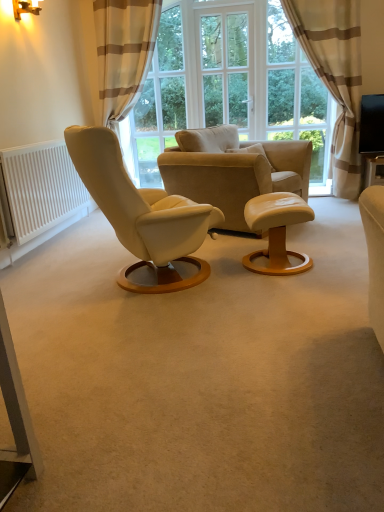
What do you see at coordinates (227, 67) in the screenshot?
I see `white glass window at center, which is counted as the 1th window screen, starting from the right` at bounding box center [227, 67].

Describe the element at coordinates (123, 53) in the screenshot. This screenshot has width=384, height=512. I see `beige striped curtain at upper left, placed as the 1th curtain when sorted from left to right` at that location.

The height and width of the screenshot is (512, 384). I want to click on beige striped curtain at upper right, which appears as the second curtain when viewed from the left, so click(335, 76).

This screenshot has width=384, height=512. Describe the element at coordinates (277, 231) in the screenshot. I see `matte white stool at center` at that location.

Locate an element on the screen. leather armchair at center is located at coordinates pos(232,170).

From a real-world perspective, is white matte radiator at left physically below beige striped curtain at upper right, which appears as the second curtain when viewed from the left?

Yes, from a real-world perspective, white matte radiator at left is below beige striped curtain at upper right, which appears as the second curtain when viewed from the left.

What's the angular difference between white matte radiator at left and beige striped curtain at upper right, which appears as the second curtain when viewed from the left,'s facing directions?

They differ by 88.9 degrees in their facing directions.

Which of these two, white matte radiator at left or beige striped curtain at upper right, the first curtain viewed from the right, is bigger?

With larger size is beige striped curtain at upper right, the first curtain viewed from the right.

Is point (301, 156) in front of point (253, 259)?

No.

In the scene shown: Can you confirm if leather armchair at center is taller than matte white stool at center?

Correct, leather armchair at center is much taller as matte white stool at center.

Does leather armchair at center contain matte white stool at center?

No, leather armchair at center does not contain matte white stool at center.

From the image's perspective, relative to matte gold wall lamp at upper left, is leather armchair at center above or below?

leather armchair at center is situated lower than matte gold wall lamp at upper left in the image.

Does point (236, 215) come behind point (38, 4)?

No, it is not.

Can you tell me how much leather armchair at center and matte gold wall lamp at upper left differ in facing direction?

leather armchair at center and matte gold wall lamp at upper left are facing 26.8 degrees away from each other.

In order to click on lamp above the leather armchair at center (from a real-world perspective) in this screenshot , I will do `click(25, 8)`.

From the image's perspective, between beige striped curtain at upper left, placed as the 1th curtain when sorted from left to right, and leather armchair at center, which one is located above?

beige striped curtain at upper left, placed as the 1th curtain when sorted from left to right, appears higher in the image.

Is beige striped curtain at upper left, which is the second curtain in right-to-left order, positioned with its back to leather armchair at center?

beige striped curtain at upper left, which is the second curtain in right-to-left order, is not turned away from leather armchair at center.

From a real-world perspective, is beige striped curtain at upper left, which is the second curtain in right-to-left order, positioned over leather armchair at center based on gravity?

Correct, in the physical world, beige striped curtain at upper left, which is the second curtain in right-to-left order, is higher than leather armchair at center.

Based on the photo, does wooden round table at center have a lesser width compared to leather armchair at center?

Yes.

Between wooden round table at center and leather armchair at center, which one has larger size?

With larger size is leather armchair at center.

Is wooden round table at center facing away from leather armchair at center?

No, leather armchair at center is not at the back of wooden round table at center.

Looking at this image, which of these two, wooden round table at center or matte white stool at center, is thinner?

wooden round table at center is thinner.

In the scene shown: Is wooden round table at center oriented towards matte white stool at center?

No.

Is wooden round table at center in front of matte white stool at center?

No.

From the image's perspective, does wooden round table at center appear higher than beige striped curtain at upper right, which appears as the second curtain when viewed from the left?

No, from the image's perspective, wooden round table at center is not over beige striped curtain at upper right, which appears as the second curtain when viewed from the left.

Considering the sizes of objects wooden round table at center and beige striped curtain at upper right, which appears as the second curtain when viewed from the left, in the image provided, who is thinner, wooden round table at center or beige striped curtain at upper right, which appears as the second curtain when viewed from the left,?

beige striped curtain at upper right, which appears as the second curtain when viewed from the left.

Are wooden round table at center and beige striped curtain at upper right, the first curtain viewed from the right, beside each other?

No.

Identify the location of curtain that is the 1st one when counting upward from the white matte radiator at left (from the image's perspective). This screenshot has width=384, height=512. coord(335,76).

The image size is (384, 512). Find the location of `chair behind the matte white stool at center`. chair behind the matte white stool at center is located at coordinates (232, 170).

When comparing their distances from matte white stool at center, does beige striped curtain at upper right, the first curtain viewed from the right, or matte gold wall lamp at upper left seem further?

The object further to matte white stool at center is matte gold wall lamp at upper left.

When comparing their distances from transparent glass window at center, positioned as the 2th window screen in right-to-left order, does beige striped curtain at upper right, the first curtain viewed from the right, or matte white stool at center seem closer?

beige striped curtain at upper right, the first curtain viewed from the right.

Which object lies further to the anchor point beige striped curtain at upper right, the first curtain viewed from the right, matte gold wall lamp at upper left or beige striped curtain at upper left, placed as the 1th curtain when sorted from left to right?

matte gold wall lamp at upper left is positioned further to the anchor beige striped curtain at upper right, the first curtain viewed from the right.

From the image, which object appears to be nearer to beige striped curtain at upper left, which is the second curtain in right-to-left order, transparent glass window at center, arranged as the 1th window screen when viewed from the left, or leather armchair at center?

transparent glass window at center, arranged as the 1th window screen when viewed from the left, is closer to beige striped curtain at upper left, which is the second curtain in right-to-left order.

Looking at the image, which one is located further to beige striped curtain at upper right, the first curtain viewed from the right, wooden round table at center or transparent glass window at center, positioned as the 2th window screen in right-to-left order?

Among the two, transparent glass window at center, positioned as the 2th window screen in right-to-left order, is located further to beige striped curtain at upper right, the first curtain viewed from the right.

From the image, which object appears to be nearer to wooden round table at center, white glass window at center, which is counted as the 1th window screen, starting from the right, or leather armchair at center?

leather armchair at center.

When comparing their distances from leather armchair at center, does white matte radiator at left or matte white stool at center seem closer?

Based on the image, matte white stool at center appears to be nearer to leather armchair at center.

Based on their spatial positions, is matte gold wall lamp at upper left or beige striped curtain at upper left, which is the second curtain in right-to-left order, closer to matte white stool at center?

matte gold wall lamp at upper left lies closer to matte white stool at center than the other object.

Find the location of a particular element. chair between beige striped curtain at upper left, which is the second curtain in right-to-left order, and beige striped curtain at upper right, the first curtain viewed from the right is located at coordinates (232, 170).

Identify the location of radiator between matte white stool at center and white glass window at center, which ranks as the second window screen in left-to-right order, in the front-back direction. Image resolution: width=384 pixels, height=512 pixels. (41, 188).

Find the location of `window screen located between transparent glass window at center, positioned as the 2th window screen in right-to-left order, and wooden round table at center in the left-right direction`. window screen located between transparent glass window at center, positioned as the 2th window screen in right-to-left order, and wooden round table at center in the left-right direction is located at coordinates (227, 67).

Find the location of a particular element. The image size is (384, 512). stool between white matte radiator at left and wooden round table at center in the horizontal direction is located at coordinates (277, 231).